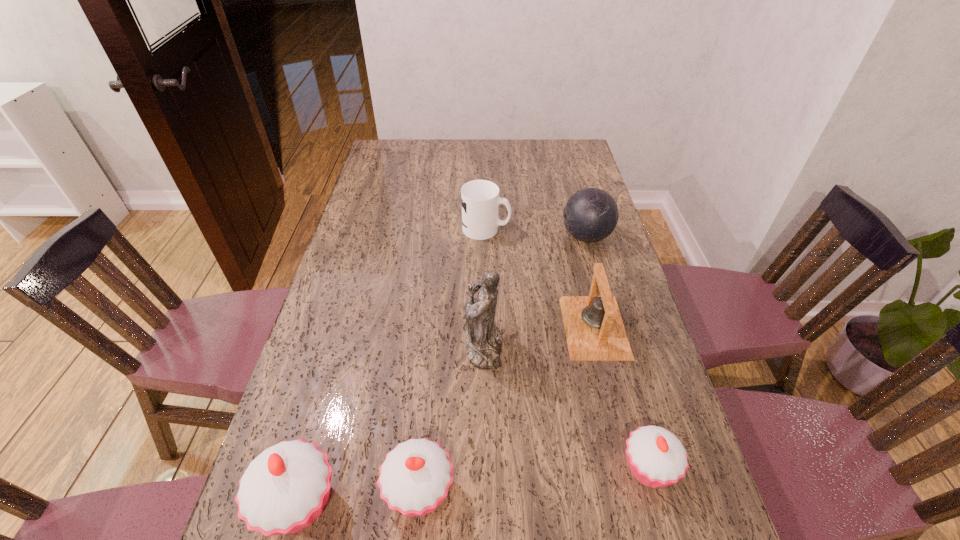
If equal spacing is desired by inserting an extra cupcake among them, please point out a free spot for this new cupcake. Please provide its 2D coordinates. Your answer should be formatted as a tuple, i.e. [(x, y)], where the tuple contains the x and y coordinates of a point satisfying the conditions above.

[(536, 479)]